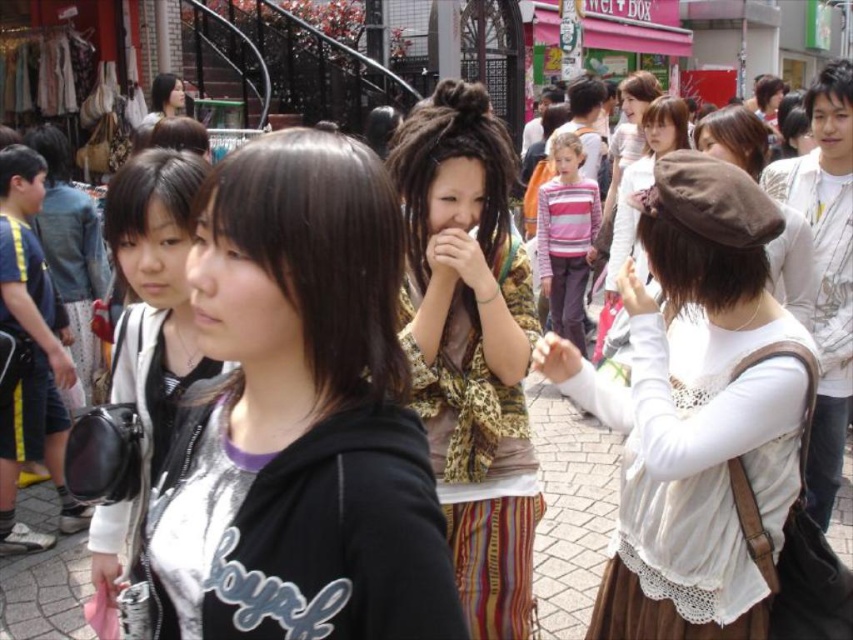
Is leopard print blouse at center thinner than matte black bag at left?

Correct, leopard print blouse at center's width is less than matte black bag at left's.

Between leopard print blouse at center and matte black bag at left, which one has more height?

leopard print blouse at center is taller.

What do you see at coordinates (471, 348) in the screenshot? The width and height of the screenshot is (853, 640). I see `leopard print blouse at center` at bounding box center [471, 348].

Locate an element on the screen. leopard print blouse at center is located at coordinates (471, 348).

What do you see at coordinates (694, 410) in the screenshot? I see `white lace blouse at center` at bounding box center [694, 410].

Between white lace blouse at center and leopard print blouse at center, which one is positioned lower?

white lace blouse at center is lower down.

Does point (704, 433) come farther from viewer compared to point (442, 205)?

No.

Locate an element on the screen. Image resolution: width=853 pixels, height=640 pixels. white lace blouse at center is located at coordinates (694, 410).

Measure the distance from white lace blouse at center to matte black bag at left.

white lace blouse at center and matte black bag at left are 52.21 feet apart from each other.

The height and width of the screenshot is (640, 853). Describe the element at coordinates (694, 410) in the screenshot. I see `white lace blouse at center` at that location.

Where is `white lace blouse at center`? This screenshot has width=853, height=640. white lace blouse at center is located at coordinates (694, 410).